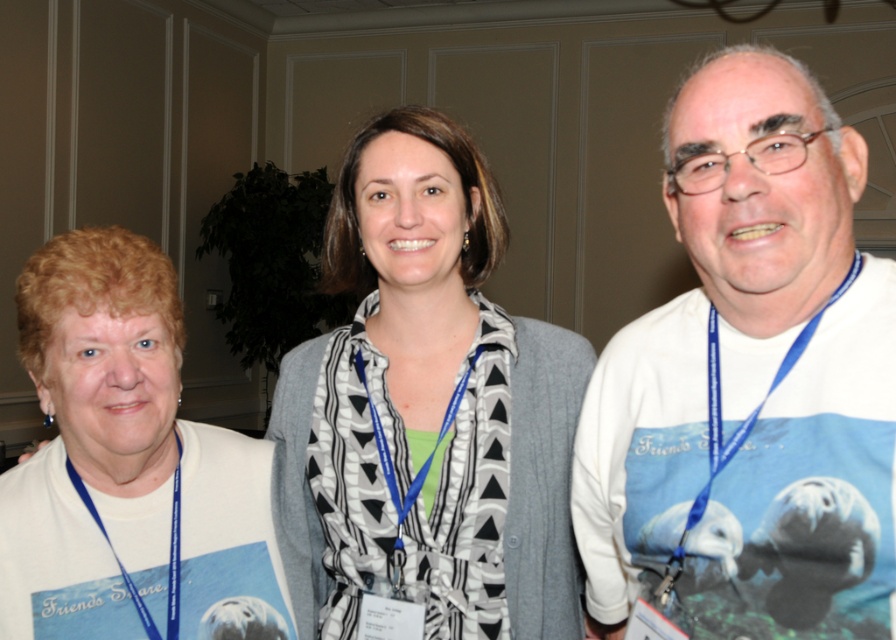
You are organizing a clothing donation drive and need to determine which item takes up more space. Based on the image, which is larger in size between the white matte shirt at center and the blue fabric lanyard at left?

The white matte shirt at center is bigger than the blue fabric lanyard at left, so the white matte shirt at center takes up more space.